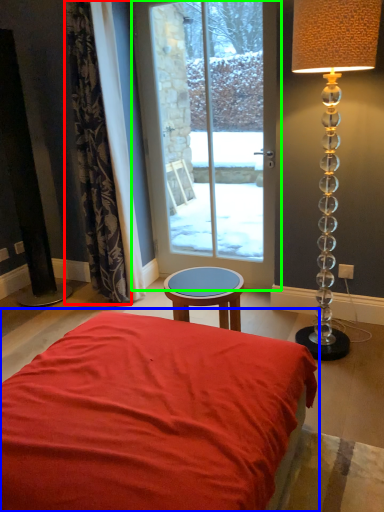
Question: Considering the real-world distances, which object is closest to curtain (highlighted by a red box)? bed (highlighted by a blue box) or door (highlighted by a green box).

Choices:
 (A) bed
 (B) door

Answer: (B)